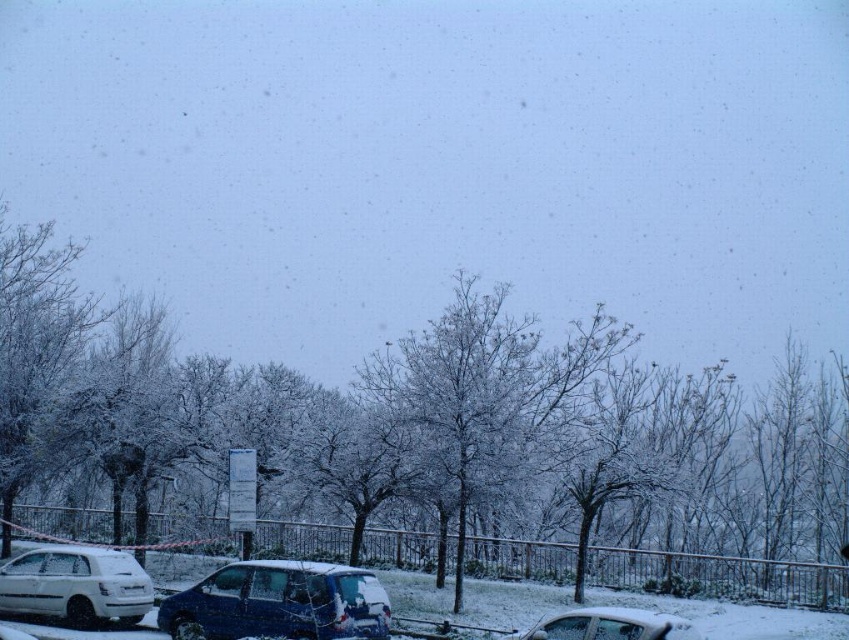
Question: Which object appears closest to the camera in this image?

Choices:
 (A) white matte car at lower center
 (B) sleek metallic van at center
 (C) white matte hatchback at lower left

Answer: (A)

Question: From the image, what is the correct spatial relationship of sleek metallic van at center in relation to white matte hatchback at lower left?

Choices:
 (A) left
 (B) right

Answer: (B)

Question: Does sleek metallic van at center have a lesser width compared to white matte car at lower center?

Choices:
 (A) yes
 (B) no

Answer: (B)

Question: Based on their relative distances, which object is farther from the white matte car at lower center?

Choices:
 (A) sleek metallic van at center
 (B) white matte hatchback at lower left

Answer: (B)

Question: Which of the following is the closest to the observer?

Choices:
 (A) (251, 600)
 (B) (32, 550)
 (C) (566, 616)

Answer: (C)

Question: Is sleek metallic van at center bigger than white matte car at lower center?

Choices:
 (A) no
 (B) yes

Answer: (B)